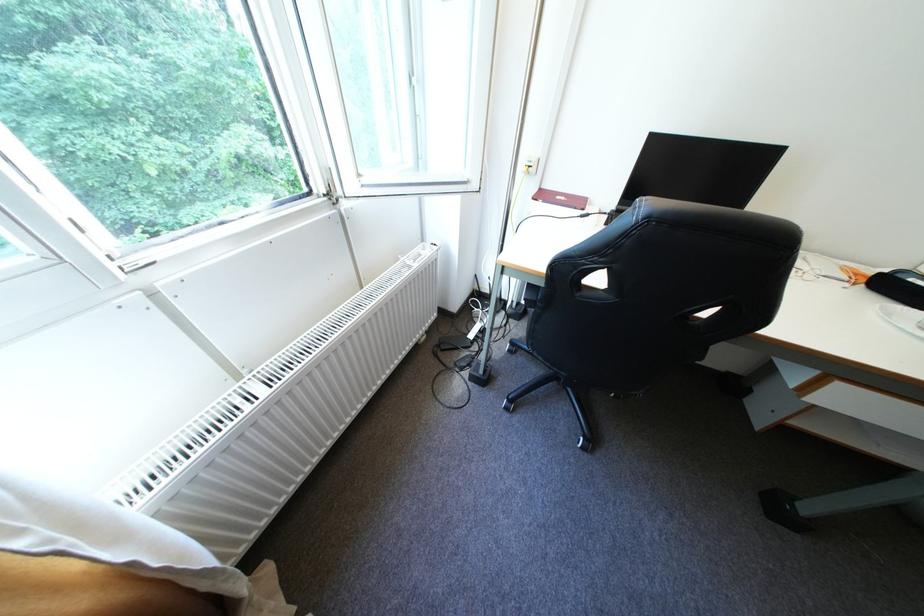
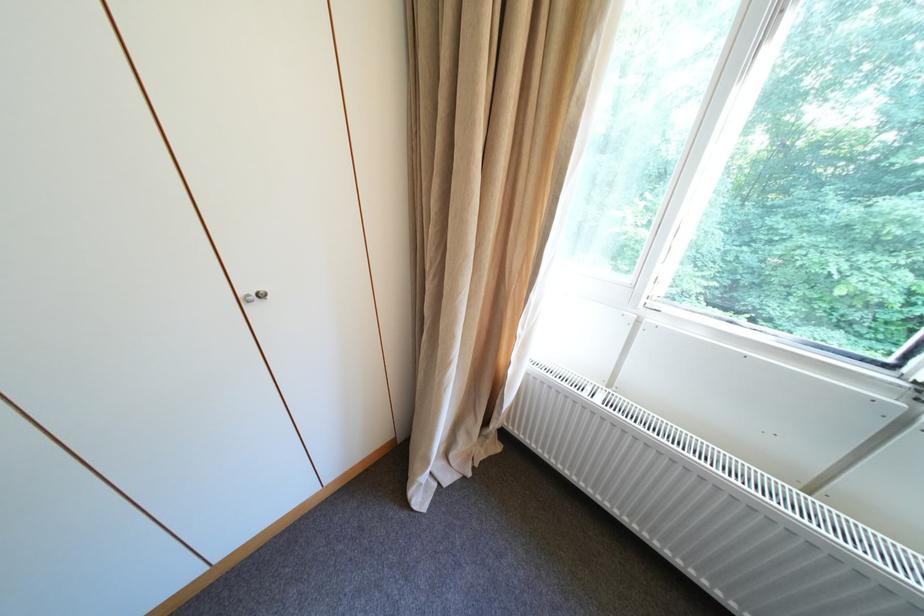
How did the camera likely rotate?

The camera rotated toward left-down.